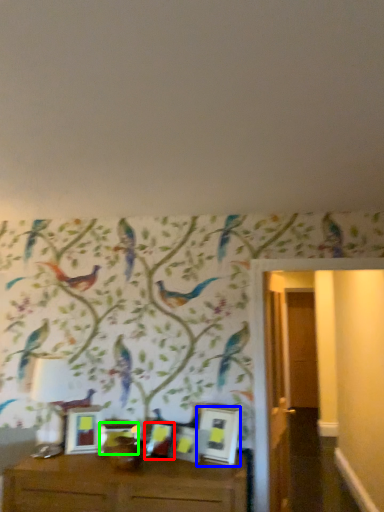
Question: Estimate the real-world distances between objects in this image. Which object is closer to picture frame (highlighted by a red box), picture frame (highlighted by a blue box) or picture frame (highlighted by a green box)?

Choices:
 (A) picture frame
 (B) picture frame

Answer: (B)